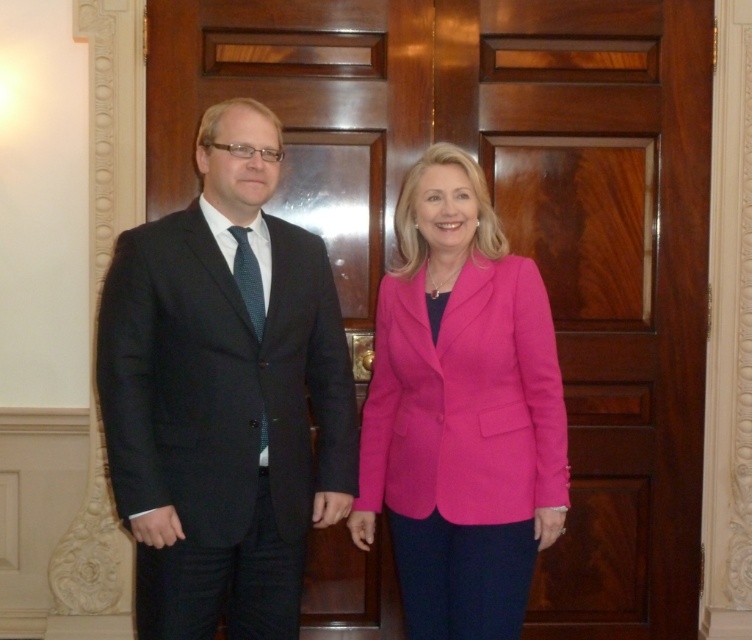
Based on the photo, you are a photographer setting up for a group photo. You need to ensure that all participants can fit within the camera frame. Given that the matte black suit at left and the pink fabric jacket at center are the widest parts of their respective outfits, will the two individuals be able to fit side by side in a frame that can accommodate a total width of 1.5 meters?

The matte black suit at left is wider than the pink fabric jacket at center. Since the total width required would be more than 1.5 meters if the matte black suit at left alone is already wider than half of that, it is uncertain without exact measurements. However, based on the given information that the matte black suit at left is wider, but without knowing the exact widths, we cannot definitively say if they will fit. The question might need more specific measurements to determine.

You are a photographer setting up a camera at eye level with the two subjects. You want to ensure that both the matte black suit at left and the pink fabric jacket at center are fully visible in the frame. Given their height difference, which subject should you position closer to the camera to avoid cropping either of them?

The matte black suit at left is much taller than the pink fabric jacket at center. To ensure both are fully visible, position the pink fabric jacket at center closer to the camera. This adjustment will help balance their sizes in the frame, preventing the taller matte black suit at left from being cropped at the top while keeping the shorter pink fabric jacket at center from appearing too small.

Based on the photo, you are standing in front of the ornate wooden door and want to hand a document to both the person in the matte black suit at left and the person in the pink fabric jacket at center. Which individual should you approach first to ensure you can reach them without moving around the door?

You should approach the matte black suit at left first because it is closer to the viewer than the pink fabric jacket at center, so you can reach them without needing to move around the door.